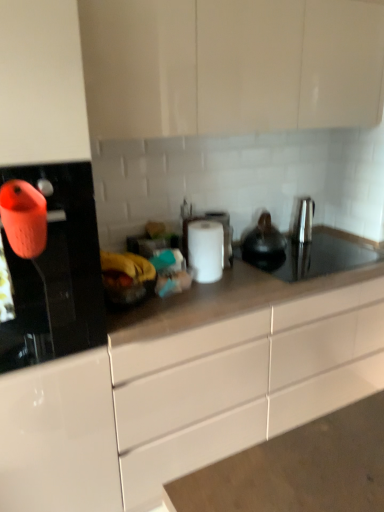
Question: Is matte white cabinets at upper center, arranged as the 2th cabinetry when ordered from the bottom, oriented towards satin nickel faucet at right?

Choices:
 (A) no
 (B) yes

Answer: (A)

Question: Does matte white cabinets at upper center, the 1th cabinetry from the top, have a lesser height compared to satin nickel faucet at right?

Choices:
 (A) yes
 (B) no

Answer: (B)

Question: Is matte white cabinets at upper center, the 1th cabinetry from the top, bigger than satin nickel faucet at right?

Choices:
 (A) yes
 (B) no

Answer: (A)

Question: From a real-world perspective, is matte white cabinets at upper center, arranged as the 2th cabinetry when ordered from the bottom, on top of satin nickel faucet at right?

Choices:
 (A) no
 (B) yes

Answer: (B)

Question: From the image's perspective, is matte white cabinets at upper center, arranged as the 2th cabinetry when ordered from the bottom, on top of satin nickel faucet at right?

Choices:
 (A) yes
 (B) no

Answer: (A)

Question: Is black matte tea pot at center inside the boundaries of white glossy cabinet at center, marked as the first cabinetry in a bottom-to-top arrangement, or outside?

Choices:
 (A) inside
 (B) outside

Answer: (B)

Question: In terms of height, does black matte tea pot at center look taller or shorter compared to white glossy cabinet at center, marked as the first cabinetry in a bottom-to-top arrangement?

Choices:
 (A) short
 (B) tall

Answer: (A)

Question: From the image's perspective, is black matte tea pot at center positioned above or below white glossy cabinet at center, the 2th cabinetry from the top?

Choices:
 (A) above
 (B) below

Answer: (A)

Question: Is black matte tea pot at center wider or thinner than white glossy cabinet at center, the 2th cabinetry from the top?

Choices:
 (A) thin
 (B) wide

Answer: (A)

Question: Looking at the image, does satin nickel faucet at right seem bigger or smaller compared to orange matte kettle at left?

Choices:
 (A) small
 (B) big

Answer: (A)

Question: Looking at their shapes, would you say satin nickel faucet at right is wider or thinner than orange matte kettle at left?

Choices:
 (A) thin
 (B) wide

Answer: (A)

Question: From the image's perspective, is satin nickel faucet at right above or below orange matte kettle at left?

Choices:
 (A) above
 (B) below

Answer: (A)

Question: Considering the positions of point (301, 232) and point (72, 344), is point (301, 232) closer or farther from the camera than point (72, 344)?

Choices:
 (A) closer
 (B) farther

Answer: (B)

Question: Is white matte paper towel at center in front of or behind matte white cabinets at upper center, the 1th cabinetry from the top, in the image?

Choices:
 (A) front
 (B) behind

Answer: (B)

Question: Is white matte paper towel at center spatially inside matte white cabinets at upper center, the 1th cabinetry from the top, or outside of it?

Choices:
 (A) outside
 (B) inside

Answer: (A)